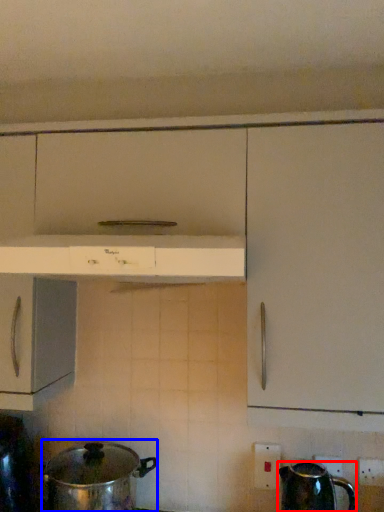
Question: Which of the following is the farthest to the observer, kettle (highlighted by a red box) or crock pot (highlighted by a blue box)?

Choices:
 (A) kettle
 (B) crock pot

Answer: (B)